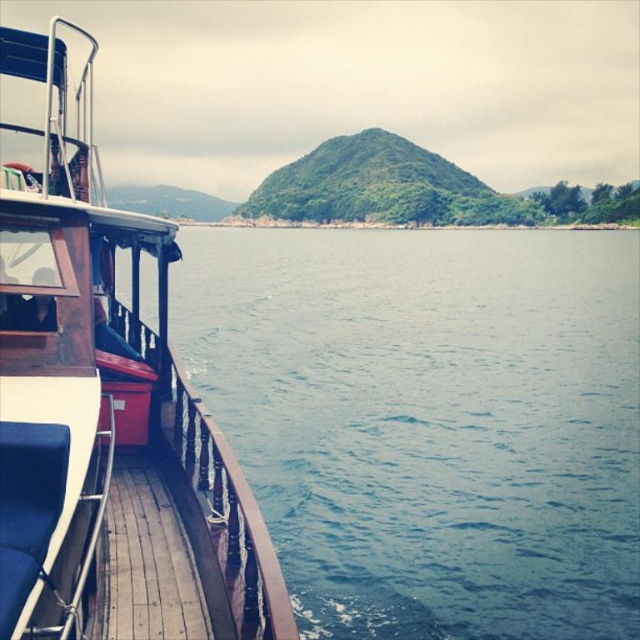
Can you confirm if blue water at lower left is positioned to the right of wooden deck boat at left?

Correct, you'll find blue water at lower left to the right of wooden deck boat at left.

Who is taller, blue water at lower left or wooden deck boat at left?

blue water at lower left

Find the location of `blue water at lower left`. blue water at lower left is located at coordinates (429, 420).

Find the location of a particular element. This screenshot has height=640, width=640. blue water at lower left is located at coordinates (429, 420).

Does wooden deck boat at left have a smaller size compared to wooden at left?

No.

The height and width of the screenshot is (640, 640). What do you see at coordinates (106, 416) in the screenshot?
I see `wooden deck boat at left` at bounding box center [106, 416].

Image resolution: width=640 pixels, height=640 pixels. I want to click on wooden deck boat at left, so click(x=106, y=416).

Image resolution: width=640 pixels, height=640 pixels. Identify the location of wooden deck boat at left. (106, 416).

How far apart are blue water at lower left and wooden rail at lower left?

blue water at lower left is 41.79 meters from wooden rail at lower left.

What do you see at coordinates (429, 420) in the screenshot? The image size is (640, 640). I see `blue water at lower left` at bounding box center [429, 420].

You are a GUI agent. You are given a task and a screenshot of the screen. Output one action in this format:
    pyautogui.click(x=<x>, y=<y>)
    Task: Click on the blue water at lower left
    
    Given the screenshot: What is the action you would take?
    pyautogui.click(x=429, y=420)